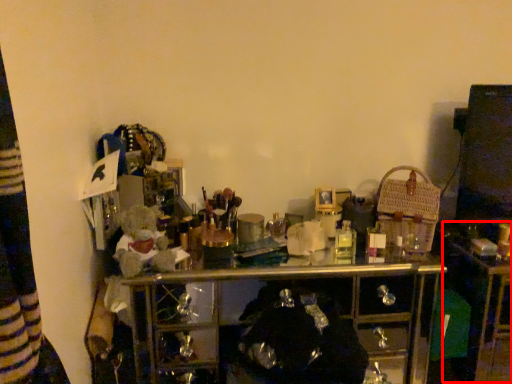
Question: From the image, what is the correct spatial relationship of computer desk (annotated by the red box) in relation to basket?

Choices:
 (A) right
 (B) left

Answer: (A)